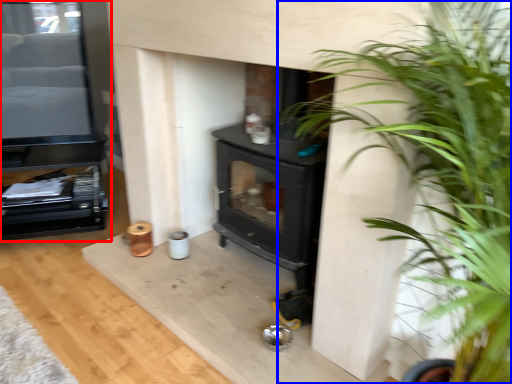
Question: Which point is closer to the camera, entertainment center (highlighted by a red box) or houseplant (highlighted by a blue box)?

Choices:
 (A) entertainment center
 (B) houseplant

Answer: (B)